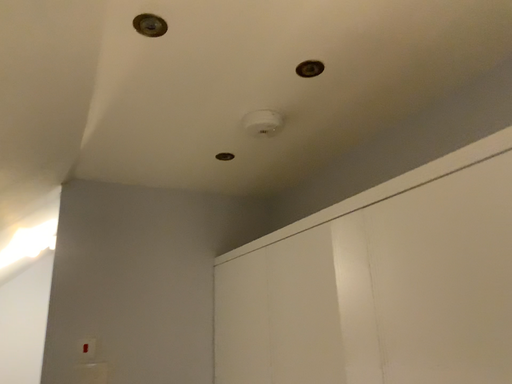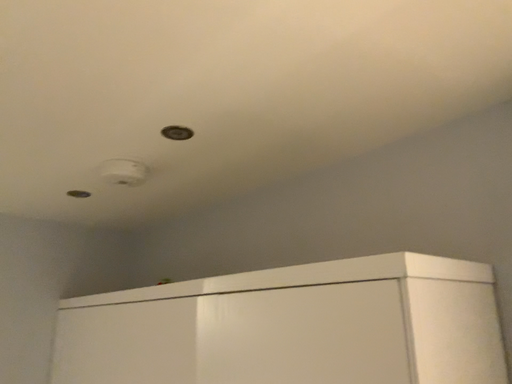
Question: Which way did the camera rotate in the video?

Choices:
 (A) rotated right
 (B) rotated left

Answer: (A)